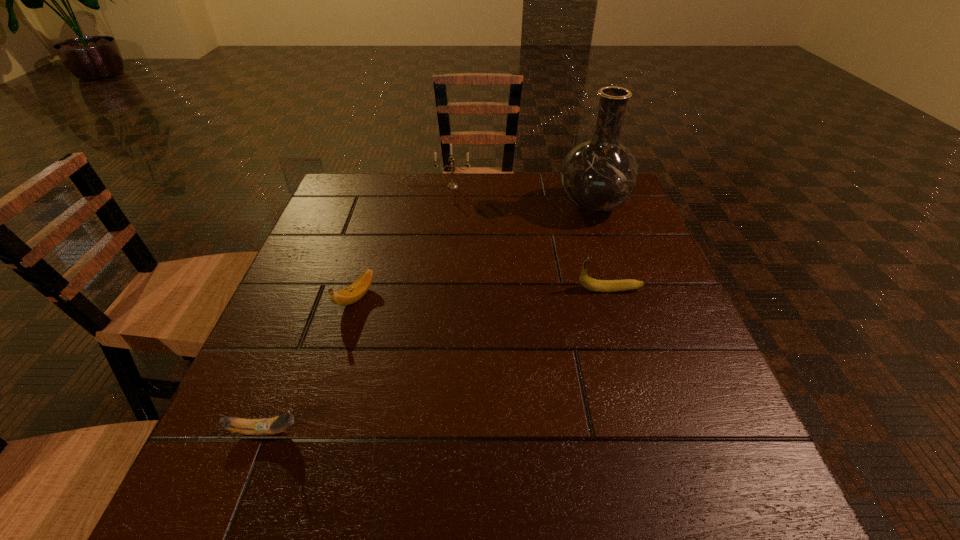
This screenshot has width=960, height=540. Identify the location of free space located at the stem of the rightmost banana. pyautogui.click(x=441, y=289).

Locate an element on the screen. The width and height of the screenshot is (960, 540). free region located at the stem of the nearest banana is located at coordinates (370, 431).

This screenshot has height=540, width=960. I want to click on vase present at the far edge, so click(x=599, y=175).

You are a GUI agent. You are given a task and a screenshot of the screen. Output one action in this format:
    pyautogui.click(x=<x>, y=<y>)
    Task: Click on the candle that is at the far edge
    This screenshot has height=540, width=960.
    Given the screenshot: What is the action you would take?
    pyautogui.click(x=452, y=185)

I want to click on vase situated at the right edge, so point(599,175).

Find the location of a particular element. The image size is (960, 540). banana at the right edge is located at coordinates (587, 282).

This screenshot has width=960, height=540. I want to click on object present at the far right corner, so pos(599,175).

Where is `blank space at the far edge of the desktop`? This screenshot has width=960, height=540. blank space at the far edge of the desktop is located at coordinates (540, 215).

Find the location of a particular element. This screenshot has width=960, height=540. free space at the near edge of the desktop is located at coordinates (514, 471).

In the image, there is a desktop. Identify the location of free region at the left edge. This screenshot has width=960, height=540. (307, 450).